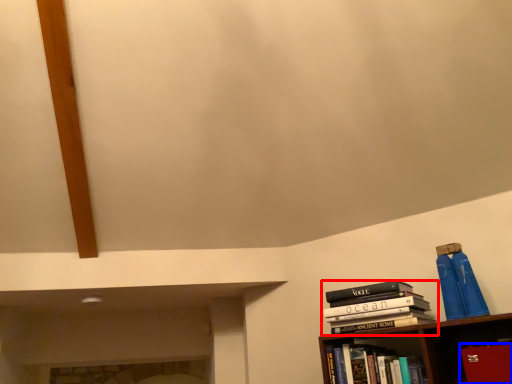
Question: Which object is further to the camera taking this photo, book (highlighted by a red box) or paperback book (highlighted by a blue box)?

Choices:
 (A) book
 (B) paperback book

Answer: (A)